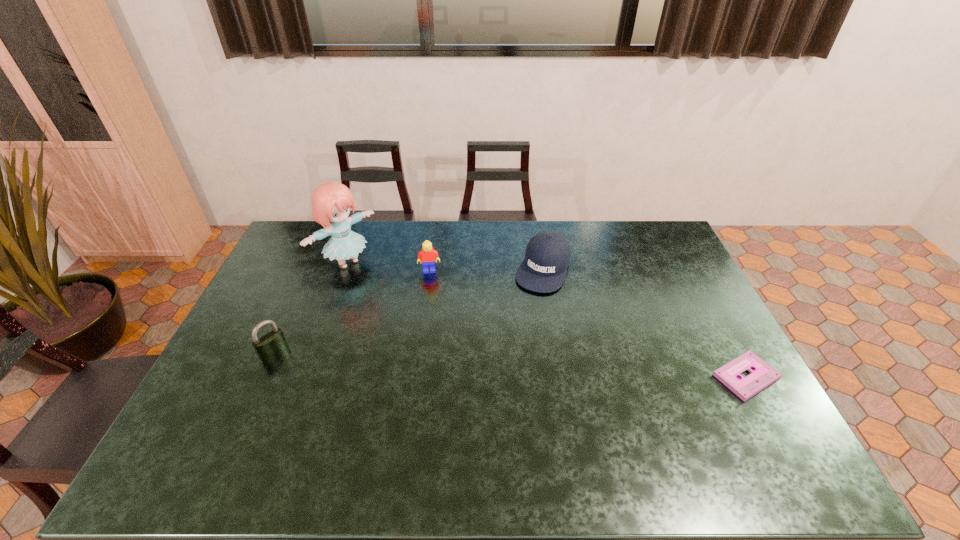
Image resolution: width=960 pixels, height=540 pixels. What are the coordinates of `padlock` in the screenshot? It's located at (272, 344).

Identify the location of the rightmost object. The image size is (960, 540). (762, 375).

Find the location of `the shortest object`. the shortest object is located at coordinates (762, 375).

The image size is (960, 540). Identify the location of the third object from right to left. (427, 256).

Identify the location of the second shortest object. The height and width of the screenshot is (540, 960). (547, 256).

Identify the location of the second object from right to left. This screenshot has height=540, width=960. (547, 256).

Where is `the tallest object`? the tallest object is located at coordinates (331, 201).

Find the location of a particular element. This screenshot has height=540, width=960. free space located 0.180m on the right of the padlock is located at coordinates (348, 353).

You are a GUI agent. You are given a task and a screenshot of the screen. Output one action in this format:
    pyautogui.click(x=<x>, y=<y>)
    Task: Click on the vacant area situated 0.150m on the left of the videotape
    This screenshot has height=540, width=960.
    Given the screenshot: What is the action you would take?
    pyautogui.click(x=659, y=377)

Locate an element on the screen. This screenshot has height=540, width=960. vacant position located on the front-facing side of the third object from right to left is located at coordinates tap(432, 298).